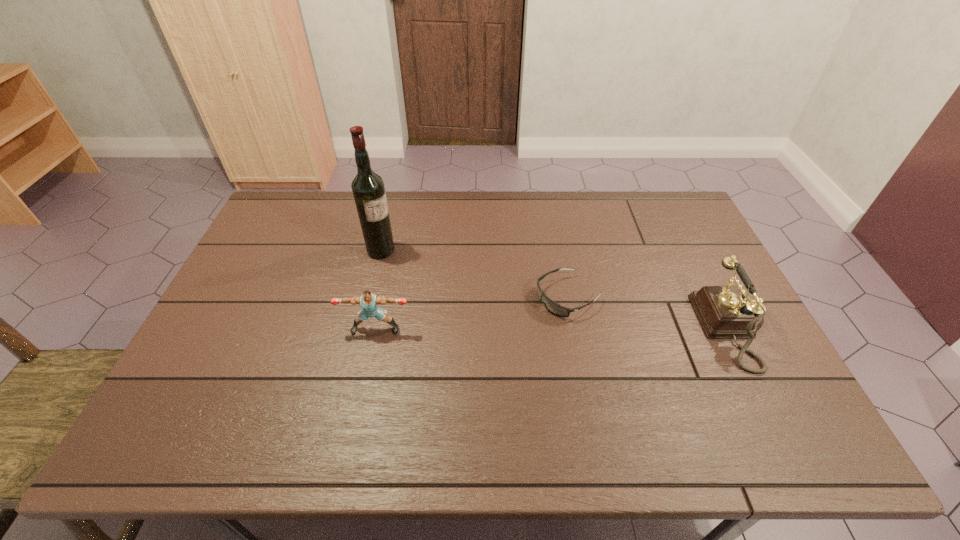
You are a GUI agent. You are given a task and a screenshot of the screen. Output one action in this format:
    pyautogui.click(x=<x>, y=<y>)
    Task: Click on the free space located on the lenses of the third object from left to right
    The image size is (960, 540).
    Given the screenshot: What is the action you would take?
    pyautogui.click(x=446, y=358)

This screenshot has width=960, height=540. I want to click on free spot located on the lenses of the third object from left to right, so click(x=446, y=358).

This screenshot has width=960, height=540. Identify the location of vacant space located on the lenses of the third object from left to right. click(514, 324).

Identify the location of object that is positioned at the right edge. This screenshot has width=960, height=540. (725, 312).

The width and height of the screenshot is (960, 540). I want to click on vacant space at the far edge, so click(412, 214).

Where is `vacant space at the near edge of the desktop`? Image resolution: width=960 pixels, height=540 pixels. vacant space at the near edge of the desktop is located at coordinates (344, 384).

At what (x,y) coordinates should I click in order to perform the action: click on vacant space at the left edge. Please return your answer as a coordinate pair (x, y). Image resolution: width=960 pixels, height=540 pixels. Looking at the image, I should click on (196, 348).

Image resolution: width=960 pixels, height=540 pixels. In order to click on free space at the near right corner of the desktop in this screenshot , I will do `click(772, 383)`.

The image size is (960, 540). Identify the location of vacant region between the tallest object and the goggles. (474, 274).

Locate an element on the screen. This screenshot has width=960, height=540. empty location between the farthest object and the goggles is located at coordinates (474, 274).